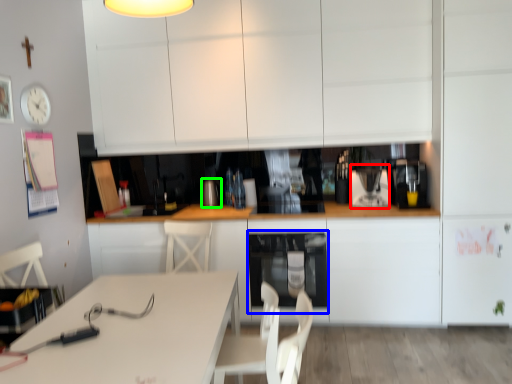
Question: Estimate the real-world distances between objects in this image. Which object is farther from appliance (highlighted by a red box), oven (highlighted by a blue box) or appliance (highlighted by a green box)?

Choices:
 (A) oven
 (B) appliance

Answer: (B)